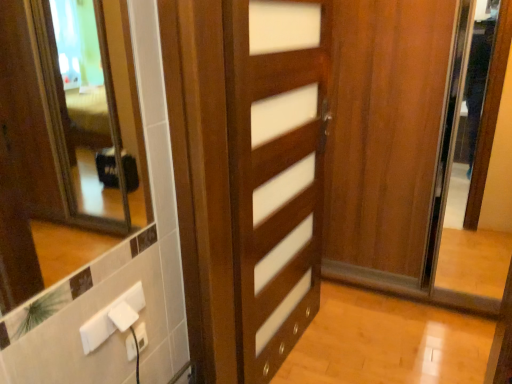
Question: From a real-world perspective, is white plastic electric outlet at lower center, positioned as the second electric outlet in top-to-bottom order, over wooden door at center?

Choices:
 (A) yes
 (B) no

Answer: (B)

Question: Is white plastic electric outlet at lower center, which is counted as the first electric outlet, starting from the bottom, to the left of wooden door at center from the viewer's perspective?

Choices:
 (A) yes
 (B) no

Answer: (A)

Question: Considering the relative sizes of white plastic electric outlet at lower center, positioned as the second electric outlet in top-to-bottom order, and wooden door at center in the image provided, is white plastic electric outlet at lower center, positioned as the second electric outlet in top-to-bottom order, shorter than wooden door at center?

Choices:
 (A) no
 (B) yes

Answer: (B)

Question: Does white plastic electric outlet at lower center, positioned as the second electric outlet in top-to-bottom order, have a greater height compared to wooden door at center?

Choices:
 (A) yes
 (B) no

Answer: (B)

Question: Is white plastic electric outlet at lower center, which is counted as the first electric outlet, starting from the bottom, oriented towards wooden door at center?

Choices:
 (A) yes
 (B) no

Answer: (B)

Question: Is wooden door at center a part of white plastic electric outlet at lower center, positioned as the second electric outlet in top-to-bottom order?

Choices:
 (A) yes
 (B) no

Answer: (B)

Question: Is white plastic electric outlet at lower left, the first electric outlet from the top, shorter than wooden door at center?

Choices:
 (A) no
 (B) yes

Answer: (B)

Question: Can you confirm if white plastic electric outlet at lower left, the 2th electric outlet in the bottom-to-top sequence, is positioned to the right of wooden door at center?

Choices:
 (A) no
 (B) yes

Answer: (A)

Question: Is white plastic electric outlet at lower left, the 2th electric outlet in the bottom-to-top sequence, facing away from wooden door at center?

Choices:
 (A) no
 (B) yes

Answer: (A)

Question: From a real-world perspective, is white plastic electric outlet at lower left, the 2th electric outlet in the bottom-to-top sequence, on wooden door at center?

Choices:
 (A) no
 (B) yes

Answer: (A)

Question: Considering the relative positions of white plastic electric outlet at lower left, the 2th electric outlet in the bottom-to-top sequence, and wooden door at center in the image provided, is white plastic electric outlet at lower left, the 2th electric outlet in the bottom-to-top sequence, in front of wooden door at center?

Choices:
 (A) no
 (B) yes

Answer: (B)

Question: Is white plastic electric outlet at lower left, the 2th electric outlet in the bottom-to-top sequence, facing towards wooden door at center?

Choices:
 (A) yes
 (B) no

Answer: (B)

Question: Does wooden door at center have a greater height compared to white plastic electric outlet at lower left, the first electric outlet from the top?

Choices:
 (A) no
 (B) yes

Answer: (B)